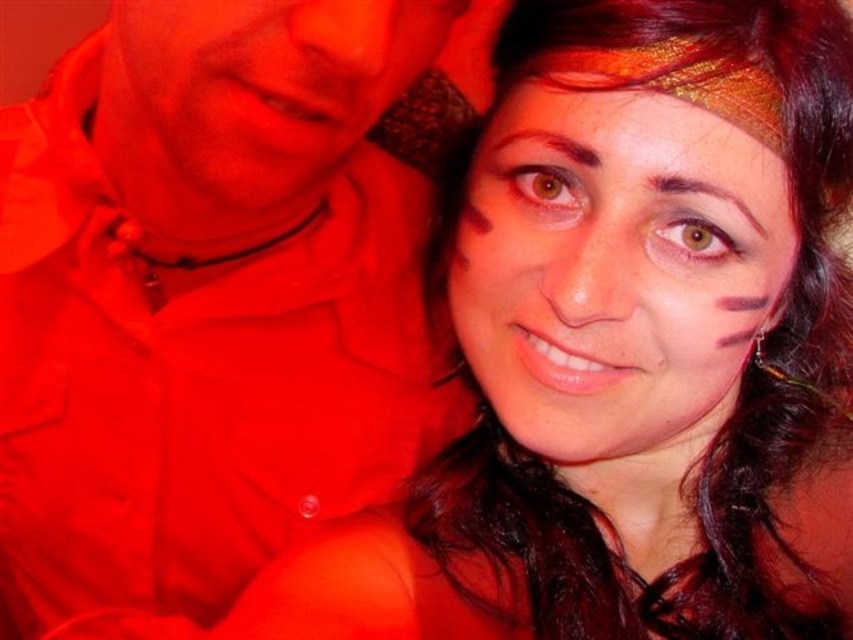
You are at a social event and see a person wearing a bright red outfit. There is a specific point on their outfit at coordinates point [206,304]. What part of the outfit is located at that point?

The point [206,304] corresponds to the matte red shirt at upper left.

You are helping to organize a costume party and need to arrange the matte red shirt at upper left and the matte gold headband at upper center on a display stand. The stand has a limited horizontal space. Which item should you place first to ensure both fit side by side?

The matte red shirt at upper left should be placed first because it is wider than the matte gold headband at upper center, allowing enough space for both items on the display stand.

You are at a social event and notice two matte red items at the upper left corner of the scene. Which one is positioned lower between the matte red shirt at upper left and the matte red face at upper left?

The matte red shirt at upper left is positioned lower than the matte red face at upper left.